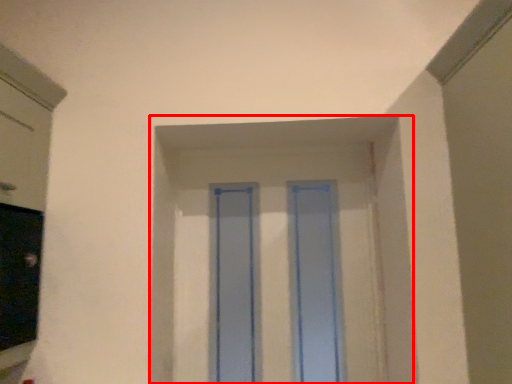
Question: Observing the image, what is the correct spatial positioning of window frame (annotated by the red box) in reference to glass door?

Choices:
 (A) right
 (B) left

Answer: (A)